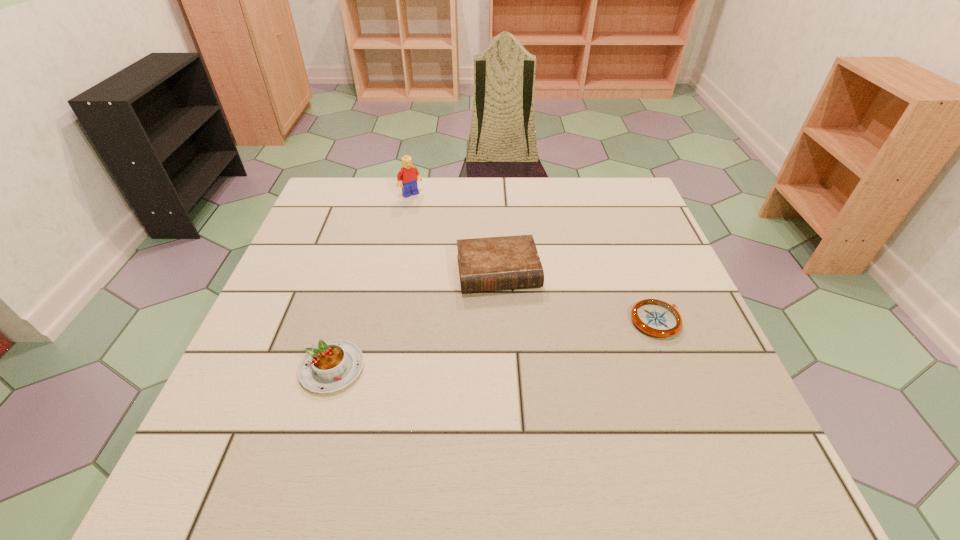
Where is `vacant space at the far edge of the desktop`? This screenshot has height=540, width=960. vacant space at the far edge of the desktop is located at coordinates (558, 214).

Where is `free space at the near edge`? This screenshot has height=540, width=960. free space at the near edge is located at coordinates (602, 392).

The image size is (960, 540). What are the coordinates of `free region at the left edge` in the screenshot? It's located at (260, 371).

The image size is (960, 540). I want to click on free space at the right edge of the desktop, so click(648, 261).

Where is `free space at the far right corner of the desktop`? free space at the far right corner of the desktop is located at coordinates (592, 188).

Where is `free space between the pudding and the Lego`? This screenshot has height=540, width=960. free space between the pudding and the Lego is located at coordinates (372, 281).

At what (x,y) coordinates should I click in order to perform the action: click on free spot between the second object from right to left and the nearest object. Please return your answer as a coordinate pair (x, y). The width and height of the screenshot is (960, 540). Looking at the image, I should click on (416, 320).

Where is `free area in between the rightmost object and the third nearest object`? This screenshot has height=540, width=960. free area in between the rightmost object and the third nearest object is located at coordinates [578, 296].

Locate an element on the screen. Image resolution: width=960 pixels, height=540 pixels. unoccupied area between the nearest object and the Lego is located at coordinates (372, 281).

Find the location of a particular element. This screenshot has width=960, height=540. free space between the diary and the shortest object is located at coordinates (578, 296).